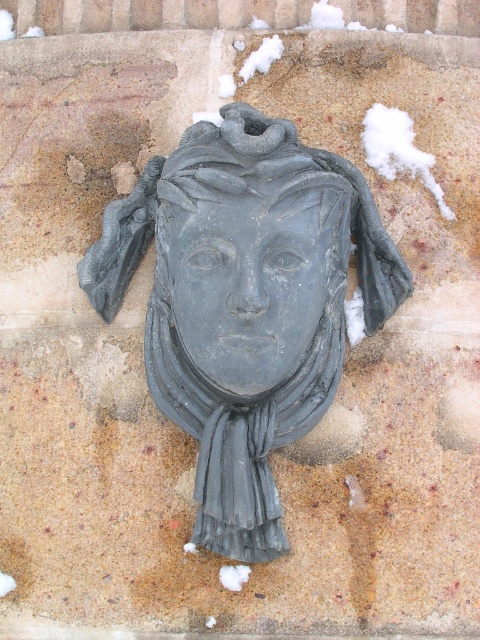
From the picture: You are an art conservator examining the stone sculpture. You notice a specific point at coordinates [248,285]. What does this point correspond to on the sculpture?

The point at coordinates [248,285] corresponds to the matte gray stone face at center.

You are an art conservator examining the stone wall. The matte gray stone face at center is positioned at coordinates 0.448, 0.517. Can you determine if this sculpture is centered horizontally on the wall?

The matte gray stone face at center is located at point (x=248, y=285), which means it is slightly offset to the right horizontally since the center of the wall would be at 0.5. Therefore, the sculpture is not perfectly centered horizontally.

Looking at this image, you are standing in front of a stone wall with two objects in front of you. You see the matte gray stone head at center and the matte gray scarf at center. Which object is closer to you?

The matte gray stone head at center is closer to the viewer than the matte gray scarf at center.